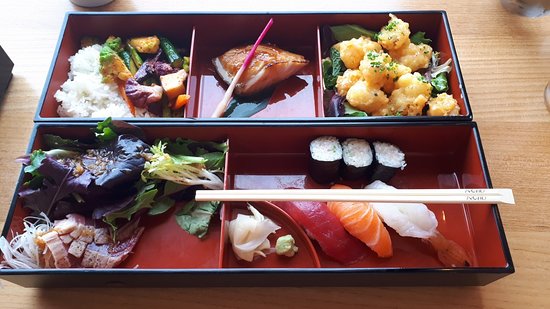
I want to click on wooden table, so click(x=495, y=107).